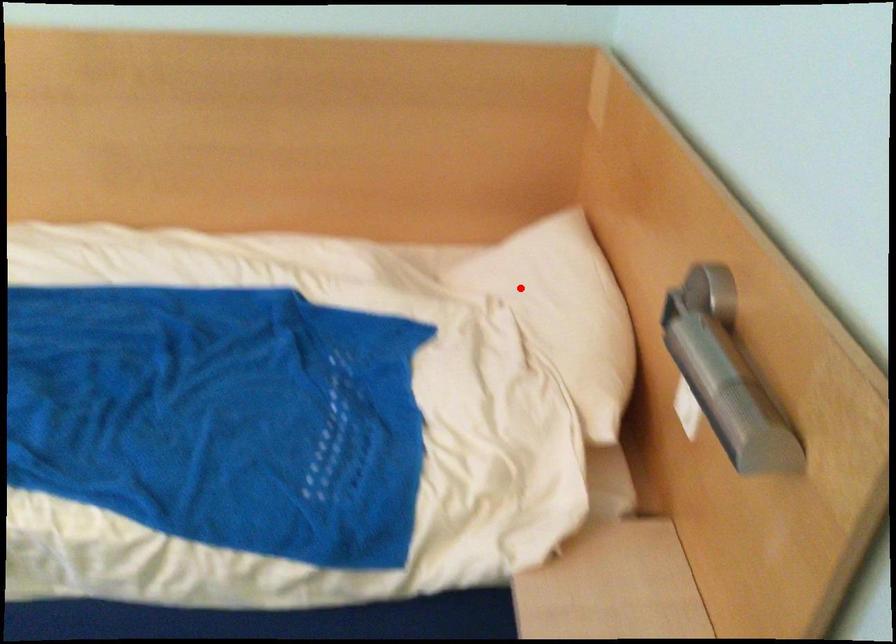
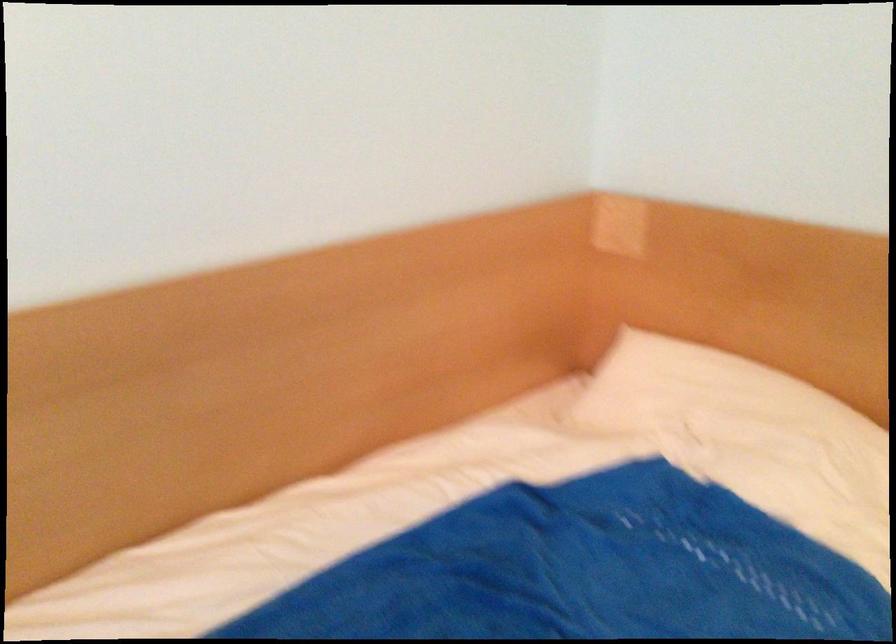
The point at the highlighted location is marked in the first image. Where is the corresponding point in the second image?

(707, 391)